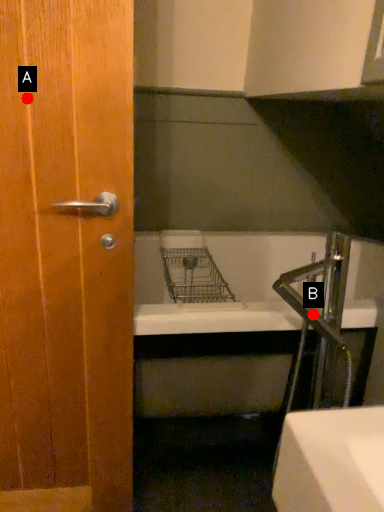
Question: Two points are circled on the image, labeled by A and B beside each circle. Which point is closer to the camera?

Choices:
 (A) A is closer
 (B) B is closer

Answer: (A)